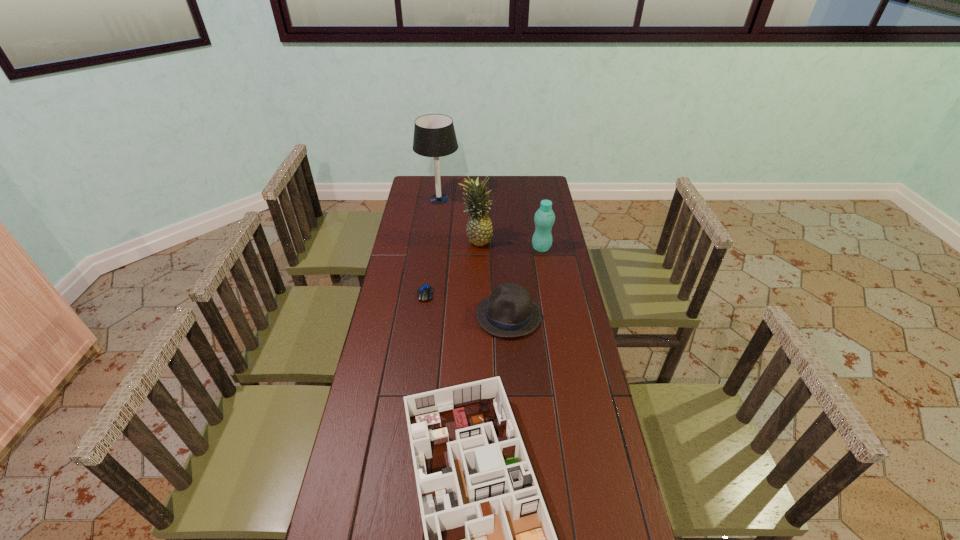
At what (x,y) coordinates should I click in order to perform the action: click on the fourth closest object to the dollhouse. Please return your answer as a coordinate pair (x, y). Looking at the image, I should click on (479, 230).

This screenshot has height=540, width=960. I want to click on object that is the closest to the third tallest object, so click(x=479, y=230).